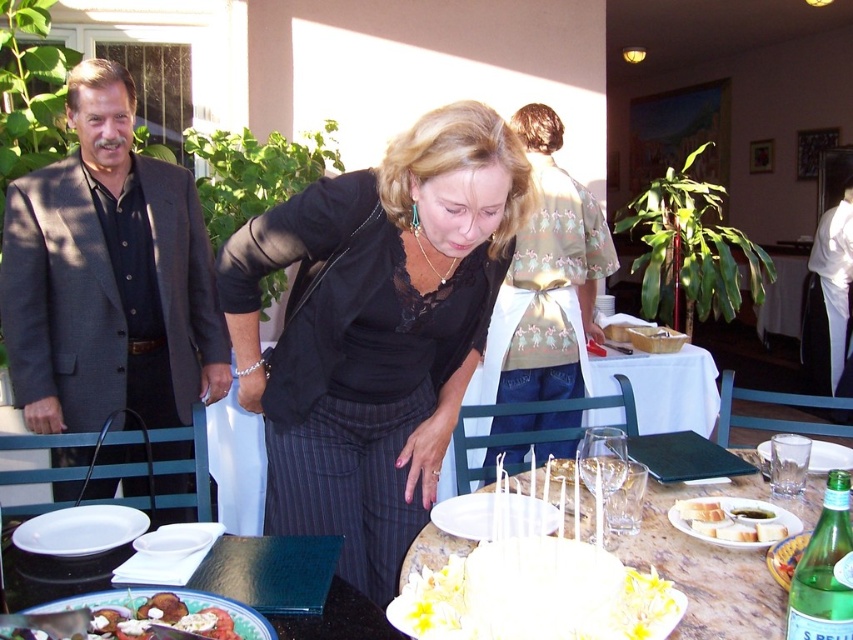
Measure the distance from matte ceramic plate at lower left to transparent glass at table right.

matte ceramic plate at lower left is 1.26 meters away from transparent glass at table right.

Does matte ceramic plate at lower left have a greater height compared to transparent glass at table right?

No.

Is point (103, 637) positioned before point (775, 461)?

That is True.

Identify the location of matte ceramic plate at lower left. Image resolution: width=853 pixels, height=640 pixels. (163, 612).

Between dark gray suit at left and white cake at center, which one appears on the left side from the viewer's perspective?

dark gray suit at left

Does dark gray suit at left appear under white cake at center?

Incorrect, dark gray suit at left is not positioned below white cake at center.

Image resolution: width=853 pixels, height=640 pixels. I want to click on dark gray suit at left, so click(108, 278).

Between point (442, 253) and point (732, 515), which one is positioned behind?

The point (442, 253) is more distant.

How far apart are matte black blouse at center and white cake at center?

33.49 inches

The image size is (853, 640). What are the coordinates of `matte black blouse at center` in the screenshot? It's located at (375, 330).